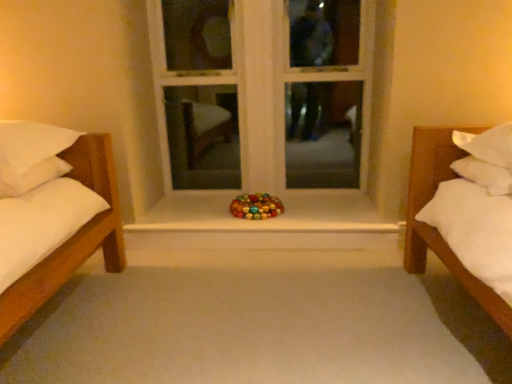
Question: Can you confirm if glossy plastic toy at center is thinner than white wood window frame at center?

Choices:
 (A) no
 (B) yes

Answer: (A)

Question: Is the position of glossy plastic toy at center less distant than that of white wood window frame at center?

Choices:
 (A) yes
 (B) no

Answer: (A)

Question: Can you confirm if glossy plastic toy at center is wider than white wood window frame at center?

Choices:
 (A) yes
 (B) no

Answer: (A)

Question: Is glossy plastic toy at center positioned beyond the bounds of white wood window frame at center?

Choices:
 (A) no
 (B) yes

Answer: (B)

Question: Could you tell me if glossy plastic toy at center is turned towards white wood window frame at center?

Choices:
 (A) yes
 (B) no

Answer: (B)

Question: In the image, is smooth white surface at center positioned in front of or behind glossy plastic toy at center?

Choices:
 (A) behind
 (B) front

Answer: (B)

Question: Is smooth white surface at center spatially inside glossy plastic toy at center, or outside of it?

Choices:
 (A) outside
 (B) inside

Answer: (A)

Question: Considering the positions of smooth white surface at center and glossy plastic toy at center in the image, is smooth white surface at center bigger or smaller than glossy plastic toy at center?

Choices:
 (A) small
 (B) big

Answer: (B)

Question: Does point (140, 226) appear closer or farther from the camera than point (270, 195)?

Choices:
 (A) closer
 (B) farther

Answer: (A)

Question: Would you say smooth white surface at center is to the left or to the right of white soft pillow at left in the picture?

Choices:
 (A) right
 (B) left

Answer: (A)

Question: From a real-world perspective, is smooth white surface at center physically located above or below white soft pillow at left?

Choices:
 (A) below
 (B) above

Answer: (A)

Question: Relative to white soft pillow at left, is smooth white surface at center in front or behind?

Choices:
 (A) behind
 (B) front

Answer: (A)

Question: In terms of height, does smooth white surface at center look taller or shorter compared to white soft pillow at left?

Choices:
 (A) short
 (B) tall

Answer: (A)

Question: From a real-world perspective, relative to smooth white surface at center, is white wood window frame at center vertically above or below?

Choices:
 (A) above
 (B) below

Answer: (A)

Question: Relative to smooth white surface at center, is white wood window frame at center in front or behind?

Choices:
 (A) behind
 (B) front

Answer: (A)